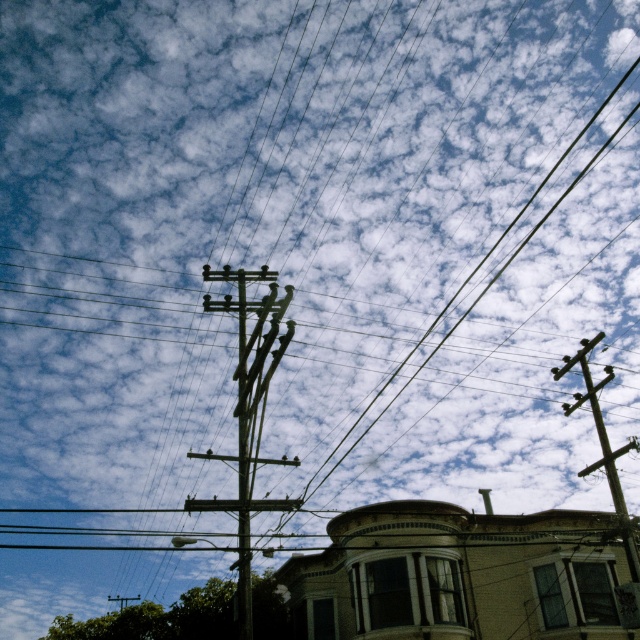
Question: Which object appears farthest from the camera in this image?

Choices:
 (A) brown wooden telegraph pole at upper right
 (B) wooden telephone pole at center

Answer: (A)

Question: Can you confirm if wooden telephone pole at center is thinner than brown wooden telegraph pole at upper right?

Choices:
 (A) no
 (B) yes

Answer: (A)

Question: Which point is closer to the camera?

Choices:
 (A) wooden telephone pole at center
 (B) brown wooden telegraph pole at upper right

Answer: (A)

Question: Can you confirm if wooden telephone pole at center is thinner than brown wooden telegraph pole at upper right?

Choices:
 (A) yes
 (B) no

Answer: (B)

Question: Does wooden telephone pole at center have a smaller size compared to brown wooden telegraph pole at upper right?

Choices:
 (A) no
 (B) yes

Answer: (A)

Question: Which object is closer to the camera taking this photo?

Choices:
 (A) brown wooden telegraph pole at upper right
 (B) wooden telephone pole at center

Answer: (B)